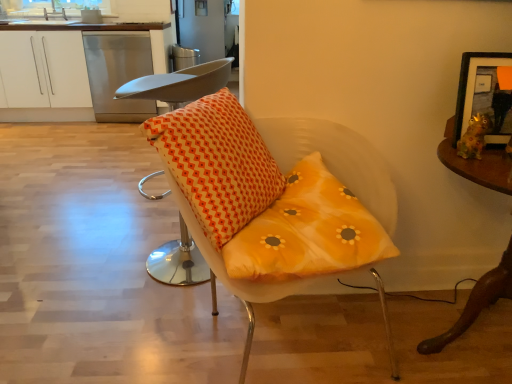
Question: Is wooden framed picture at upper right further to camera compared to orange fabric cushion at center, arranged as the 1th chair when viewed from the left?

Choices:
 (A) no
 (B) yes

Answer: (A)

Question: From a real-world perspective, does wooden framed picture at upper right stand above orange fabric cushion at center, arranged as the 1th chair when viewed from the left?

Choices:
 (A) yes
 (B) no

Answer: (A)

Question: Does wooden framed picture at upper right have a greater height compared to orange fabric cushion at center, arranged as the 1th chair when viewed from the left?

Choices:
 (A) no
 (B) yes

Answer: (A)

Question: Would you consider wooden framed picture at upper right to be distant from orange fabric cushion at center, arranged as the 1th chair when viewed from the left?

Choices:
 (A) yes
 (B) no

Answer: (A)

Question: Is wooden framed picture at upper right turned away from orange fabric cushion at center, arranged as the 1th chair when viewed from the left?

Choices:
 (A) yes
 (B) no

Answer: (B)

Question: Is wooden framed picture at upper right inside or outside of orange fabric cushion at center, arranged as the 1th chair when viewed from the left?

Choices:
 (A) inside
 (B) outside

Answer: (B)

Question: In terms of width, does wooden framed picture at upper right look wider or thinner when compared to orange fabric cushion at center, positioned as the second chair in right-to-left order?

Choices:
 (A) thin
 (B) wide

Answer: (A)

Question: From a real-world perspective, relative to orange fabric cushion at center, positioned as the second chair in right-to-left order, is wooden framed picture at upper right vertically above or below?

Choices:
 (A) above
 (B) below

Answer: (A)

Question: Would you say wooden framed picture at upper right is to the left or to the right of orange fabric cushion at center, positioned as the second chair in right-to-left order, in the picture?

Choices:
 (A) right
 (B) left

Answer: (A)

Question: Would you say yellow fabric cushion at center, which is counted as the second chair, starting from the left, is to the left or to the right of orange printed cushion at center in the picture?

Choices:
 (A) left
 (B) right

Answer: (B)

Question: From a real-world perspective, is yellow fabric cushion at center, placed as the 1th chair when sorted from right to left, physically located above or below orange printed cushion at center?

Choices:
 (A) below
 (B) above

Answer: (A)

Question: Looking at the image, does yellow fabric cushion at center, which is counted as the second chair, starting from the left, seem bigger or smaller compared to orange printed cushion at center?

Choices:
 (A) small
 (B) big

Answer: (B)

Question: Relative to orange printed cushion at center, is yellow fabric cushion at center, placed as the 1th chair when sorted from right to left, in front or behind?

Choices:
 (A) front
 (B) behind

Answer: (A)

Question: From the image's perspective, is orange printed cushion at center located above or below stainless steel dishwasher at upper left?

Choices:
 (A) above
 (B) below

Answer: (B)

Question: Is point (181, 190) positioned closer to the camera than point (146, 110)?

Choices:
 (A) farther
 (B) closer

Answer: (B)